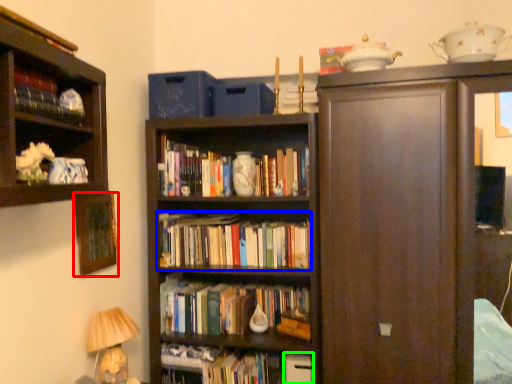
Question: Which object is the closest to the picture frame (highlighted by a red box)? Choose among these: book (highlighted by a blue box) or paperback book (highlighted by a green box).

Choices:
 (A) book
 (B) paperback book

Answer: (A)